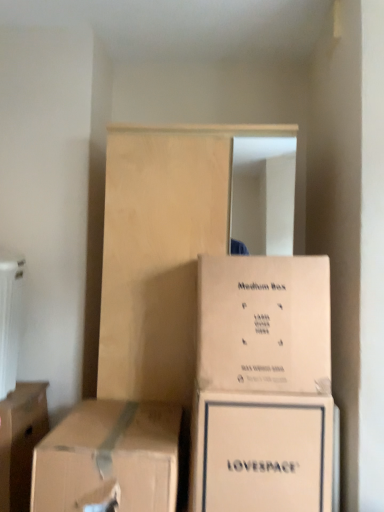
Question: Considering their positions, is light wood dresser at center located in front of or behind beige cardboard box at center, arranged as the fourth box when viewed from the left?

Choices:
 (A) behind
 (B) front

Answer: (A)

Question: From the image's perspective, is light wood dresser at center positioned above or below beige cardboard box at center, arranged as the fourth box when viewed from the left?

Choices:
 (A) above
 (B) below

Answer: (B)

Question: Which of these objects is positioned farthest from the white cardboard box at lower center, placed as the third box when sorted from left to right?

Choices:
 (A) light wood dresser at center
 (B) brown cardboard box at lower left, the fourth box viewed from the right
 (C) white plastic radiator at left
 (D) beige cardboard box at center, arranged as the fourth box when viewed from the left
 (E) brown cardboard box at lower left, arranged as the 3th box when viewed from the right

Answer: (C)

Question: Which of these objects is positioned closest to the white cardboard box at lower center, placed as the third box when sorted from left to right?

Choices:
 (A) brown cardboard box at lower left, acting as the 2th box starting from the left
 (B) beige cardboard box at center, acting as the first box starting from the right
 (C) brown cardboard box at lower left, arranged as the first box when viewed from the left
 (D) white plastic radiator at left
 (E) light wood dresser at center

Answer: (B)